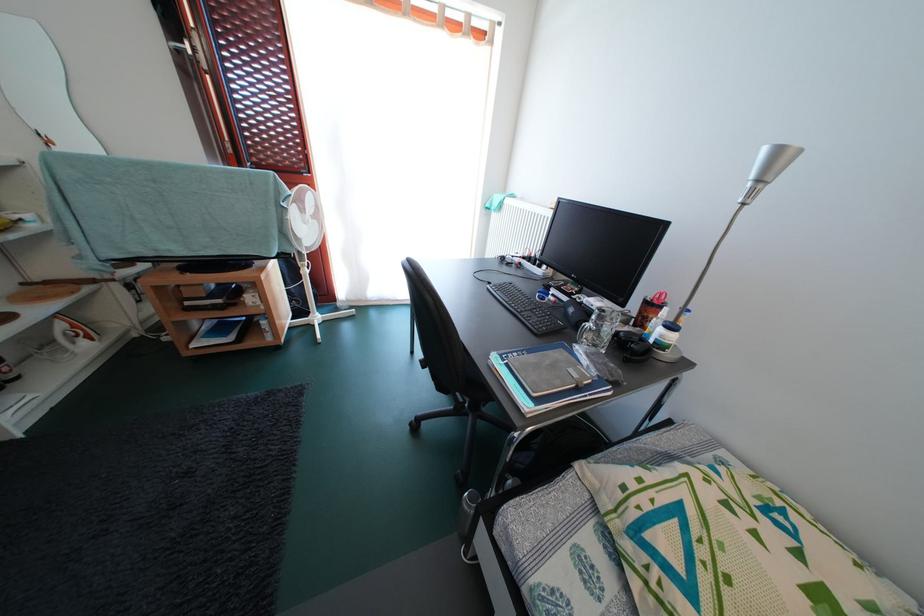
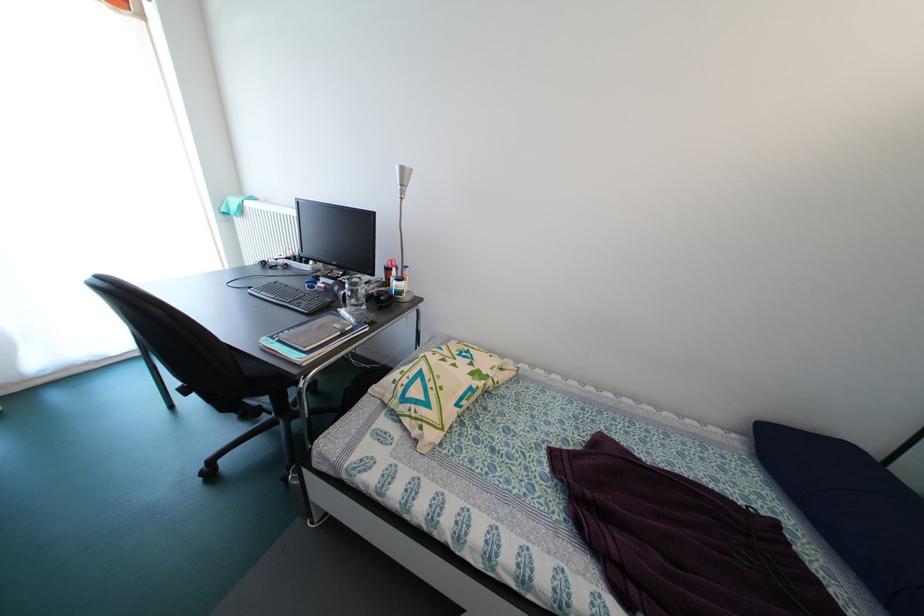
The point at (418, 430) is marked in the first image. Where is the corresponding point in the second image?

(209, 479)